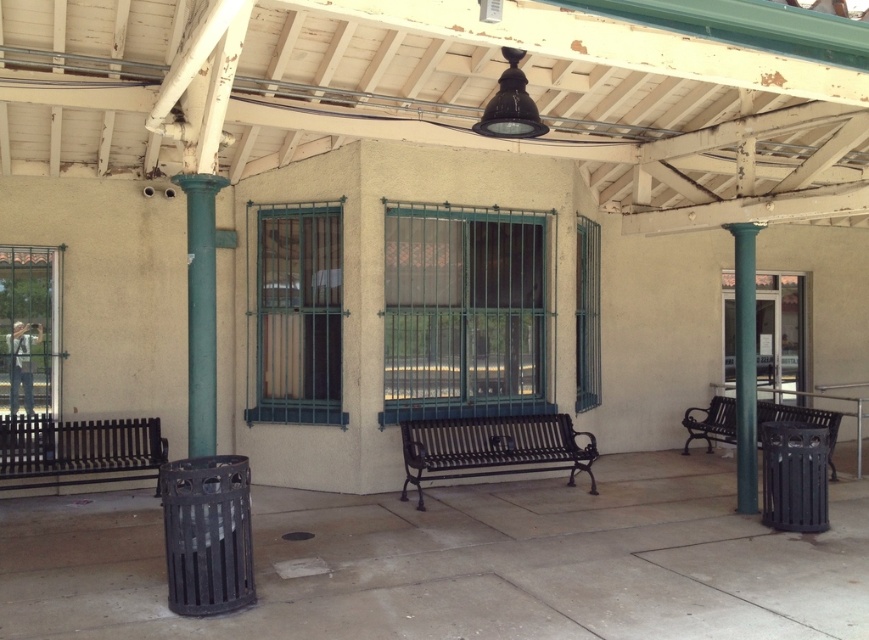
You are a passenger waiting at the station. You see the black metal bench at left and the green painted metal column at right. Which object is closer to the left side of the waiting area?

The black metal bench at left is closer to the left side of the waiting area because it is positioned to the left of the green painted metal column at right.

You are a person sitting on the black wrought iron bench at center. You want to stand up and walk towards the green painted metal column at right. Is the column above or below you when you look up from the bench?

The green painted metal column at right is above the black wrought iron bench at center, so when you look up from the bench, the column will be above you.

From the picture: You are a maintenance worker needing to reach the green painted metal column at right from your current position near the black metal bench at left. Given that your tool cart is 2 meters long, will you have enough space to maneuver it between them?

The distance between the black metal bench at left and the green painted metal column at right is 6.51 meters. Since the tool cart is only 2 meters long, there is sufficient space to maneuver it between them.